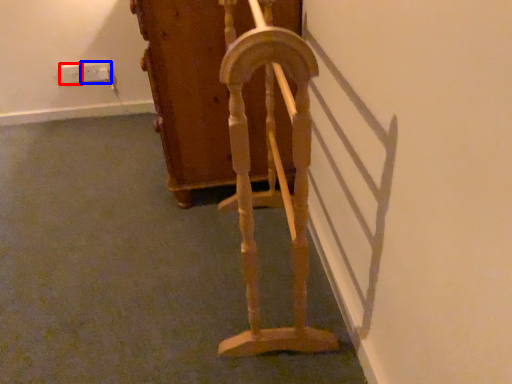
Question: Which object is closer to the camera taking this photo, electric outlet (highlighted by a red box) or electric outlet (highlighted by a blue box)?

Choices:
 (A) electric outlet
 (B) electric outlet

Answer: (A)